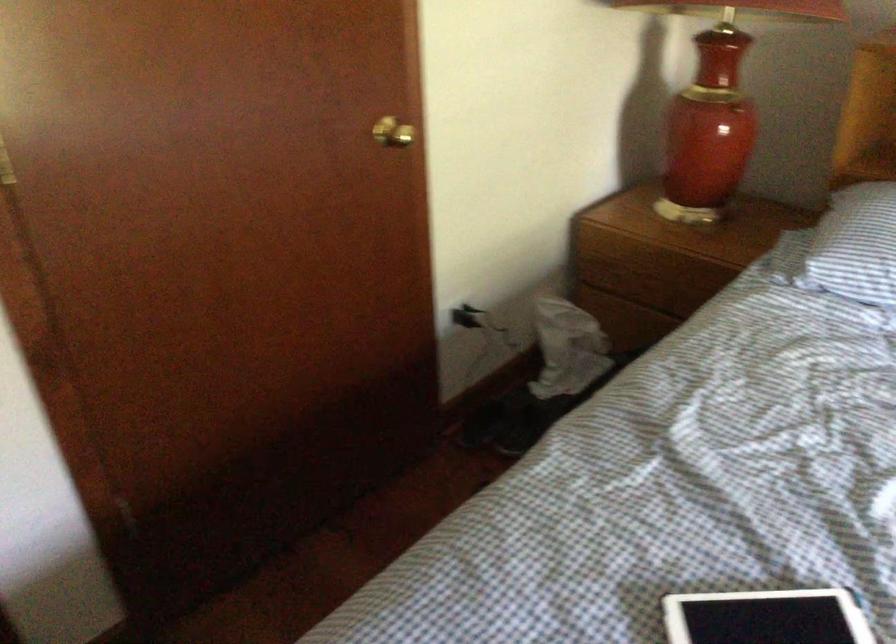
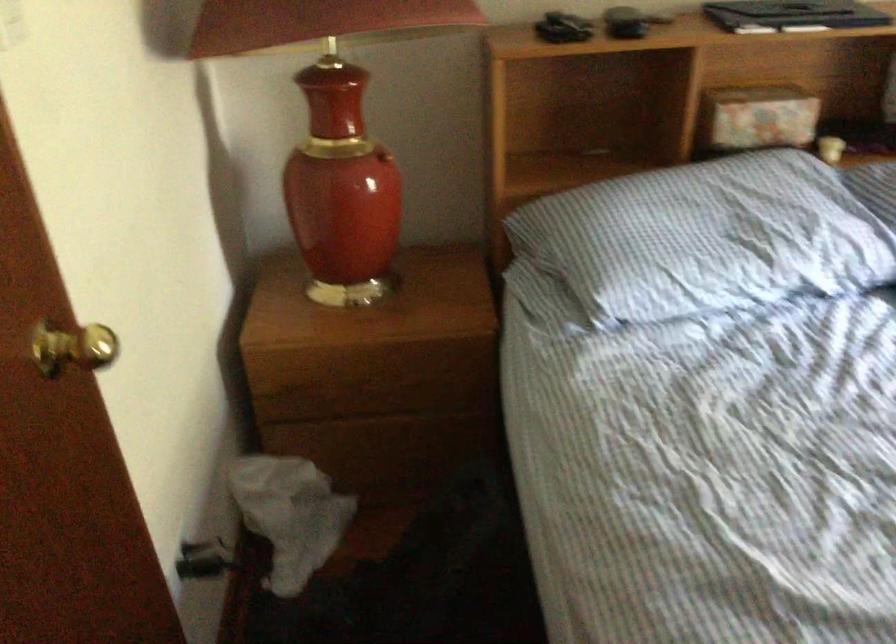
Question: Based on the continuous images, in which direction is the camera rotating? Reply with the corresponding letter.

Choices:
 (A) Left
 (B) Right
 (C) Up
 (D) Down

Answer: (B)